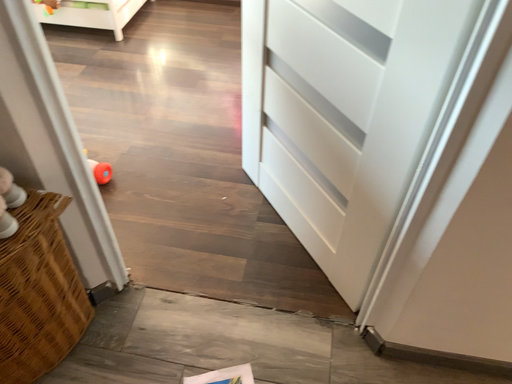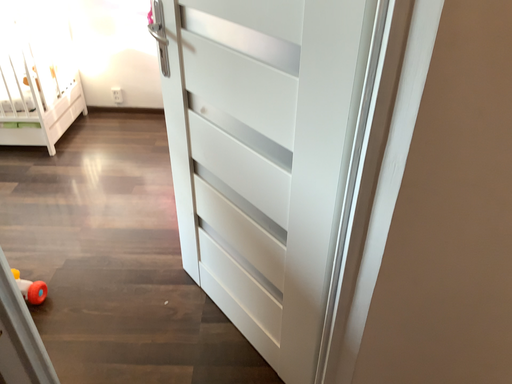
Question: How did the camera likely rotate when shooting the video?

Choices:
 (A) rotated left
 (B) rotated right

Answer: (B)